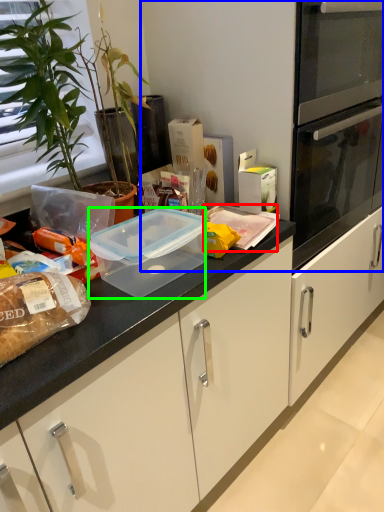
Question: Which object is positioned closest to food (highlighted by a red box)? Select from fridge (highlighted by a blue box) and appliance (highlighted by a green box).

Choices:
 (A) fridge
 (B) appliance

Answer: (B)